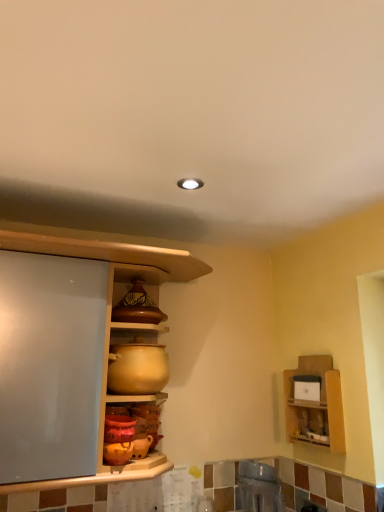
Question: Looking at their shapes, would you say wooden shelf at upper right is wider or thinner than metallic stainless steel sink at lower center, which is the second appliance in left-to-right order?

Choices:
 (A) wide
 (B) thin

Answer: (B)

Question: Would you say wooden shelf at upper right is inside or outside metallic stainless steel sink at lower center, which is the second appliance in left-to-right order?

Choices:
 (A) inside
 (B) outside

Answer: (B)

Question: Estimate the real-world distances between objects in this image. Which object is closer to the matte wood cabinet at center?

Choices:
 (A) matte brown ceramic pot at upper center
 (B) matte ceramic pot at center, which appears as the second appliance when viewed from the right
 (C) matte orange pot at lower center
 (D) wooden shelf at upper right
 (E) metallic stainless steel sink at lower center, which appears as the first appliance when ordered from the bottom

Answer: (A)

Question: Estimate the real-world distances between objects in this image. Which object is farther from the matte ceramic pot at center, the second appliance ordered from the bottom?

Choices:
 (A) matte wood cabinet at center
 (B) metallic stainless steel sink at lower center, which is the second appliance in left-to-right order
 (C) matte orange pot at lower center
 (D) matte brown ceramic pot at upper center
 (E) wooden shelf at upper right

Answer: (E)